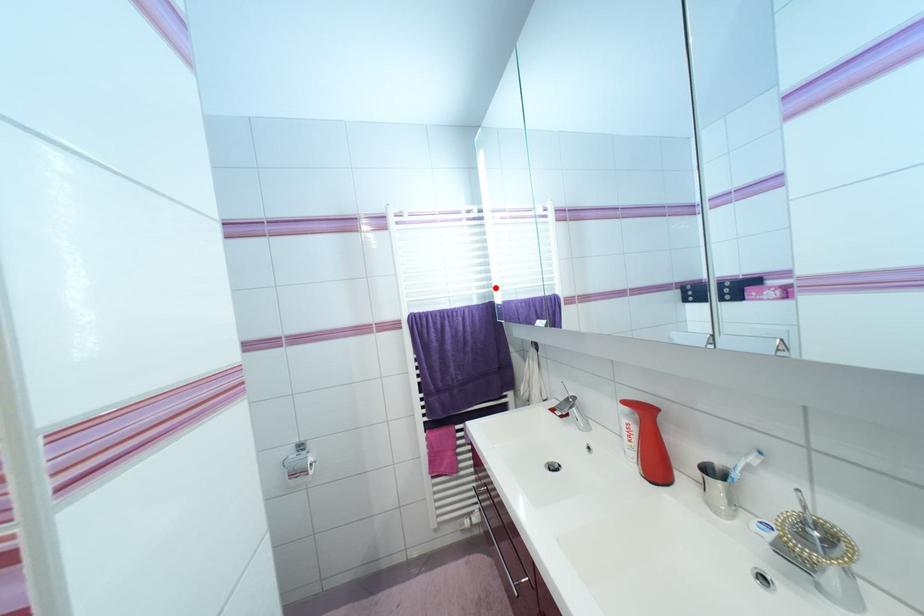
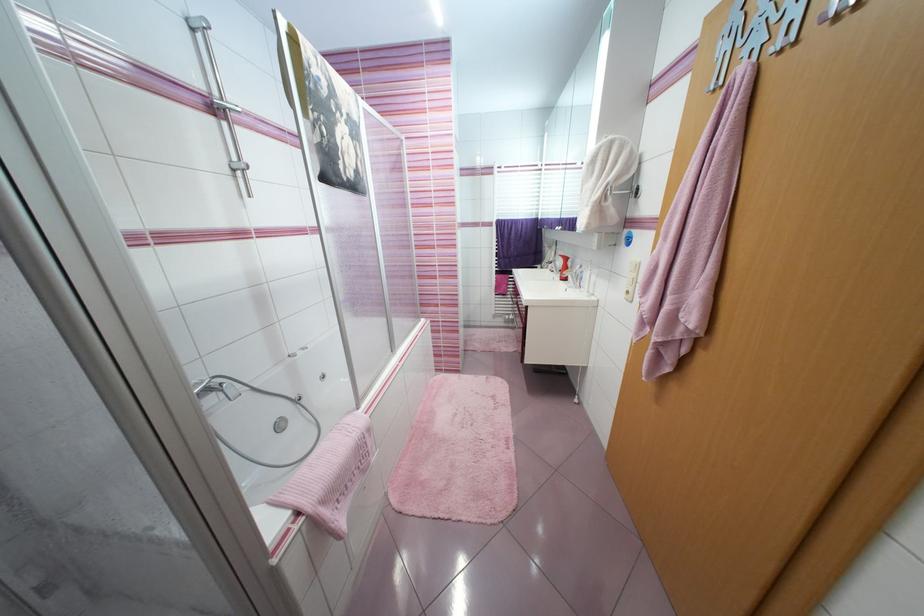
In the second image, find the point that corresponds to the highlighted location in the first image.

(543, 211)